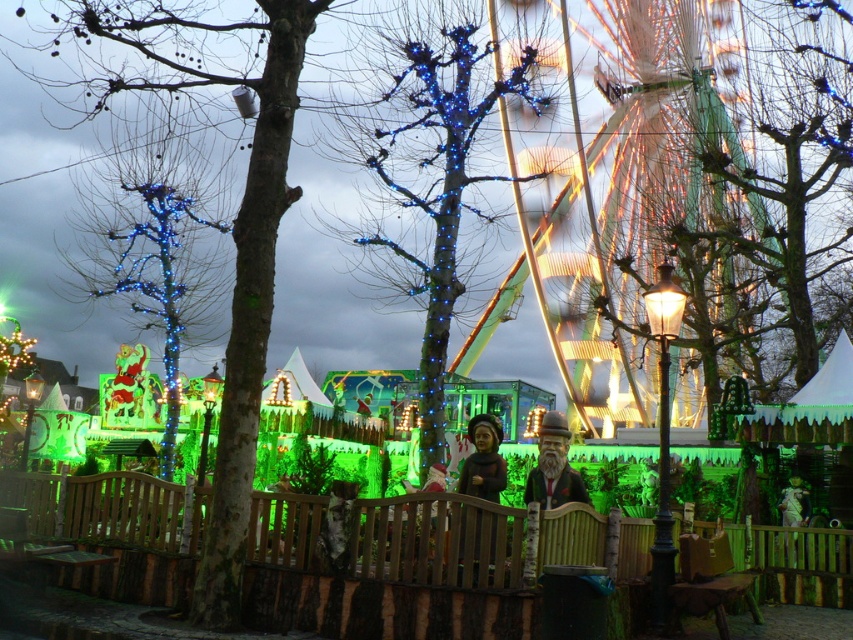
You are at the fairground and want to take a photo of both the blue led lights at center and the wooden statue at center. Which object should you focus on first if you want to ensure both are in the frame without moving the camera?

Since the blue led lights at center are taller than the wooden statue at center, you should focus on the blue led lights at center first to ensure both are in the frame without moving the camera.

Based on the photo, you are at the fairground and want to take a photo of both the illuminated metal ferris wheel at upper right and the wooden statue at center. Which object should you zoom in on first to ensure both fit in the frame?

You should zoom in on the wooden statue at center first because the illuminated metal ferris wheel at upper right is bigger, so adjusting for the larger object might require a different framing.

You are at the fairground and want to take a photo of both the blue led lights at center and the wooden statue at center. The camera you have can capture objects up to 30 meters apart in the same frame. Can you fit both objects in the same photo without moving the camera?

The blue led lights at center is 30.46 meters from wooden statue at center. Since the distance between them exceeds the camera maximum range of 30 meters, you cannot fit both in the same photo without moving the camera.